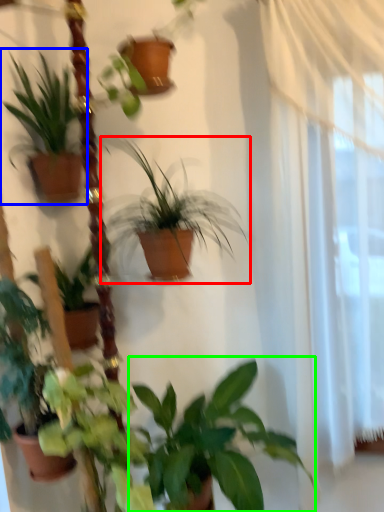
Question: Estimate the real-world distances between objects in this image. Which object is farther from houseplant (highlighted by a red box), houseplant (highlighted by a blue box) or houseplant (highlighted by a green box)?

Choices:
 (A) houseplant
 (B) houseplant

Answer: (B)